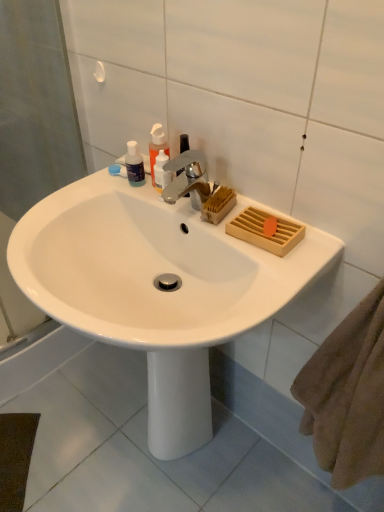
Question: Is translucent plastic soap dispenser at upper center surrounded by white glossy sink at center?

Choices:
 (A) yes
 (B) no

Answer: (B)

Question: From the image's perspective, is white glossy sink at center under translucent plastic soap dispenser at upper center?

Choices:
 (A) no
 (B) yes

Answer: (B)

Question: Does white glossy sink at center have a greater width compared to translucent plastic soap dispenser at upper center?

Choices:
 (A) no
 (B) yes

Answer: (B)

Question: Is the surface of white glossy sink at center in direct contact with translucent plastic soap dispenser at upper center?

Choices:
 (A) no
 (B) yes

Answer: (A)

Question: Can you confirm if white glossy sink at center is smaller than translucent plastic soap dispenser at upper center?

Choices:
 (A) no
 (B) yes

Answer: (A)

Question: Would you say white glossy sink at center is outside translucent plastic soap dispenser at upper center?

Choices:
 (A) no
 (B) yes

Answer: (B)

Question: Can you confirm if translucent plastic bottles at upper left, which ranks as the second toiletry in left-to-right order, is smaller than translucent plastic soap dispenser at upper center?

Choices:
 (A) no
 (B) yes

Answer: (B)

Question: From the image's perspective, is translucent plastic bottles at upper left, which ranks as the second toiletry in left-to-right order, below translucent plastic soap dispenser at upper center?

Choices:
 (A) no
 (B) yes

Answer: (B)

Question: Is translucent plastic bottles at upper left, which ranks as the second toiletry in left-to-right order, not inside translucent plastic soap dispenser at upper center?

Choices:
 (A) no
 (B) yes

Answer: (B)

Question: Considering the relative positions of translucent plastic bottles at upper left, which ranks as the second toiletry in left-to-right order, and translucent plastic soap dispenser at upper center in the image provided, is translucent plastic bottles at upper left, which ranks as the second toiletry in left-to-right order, to the left of translucent plastic soap dispenser at upper center from the viewer's perspective?

Choices:
 (A) yes
 (B) no

Answer: (B)

Question: Is translucent plastic bottles at upper left, which ranks as the second toiletry in left-to-right order, with translucent plastic soap dispenser at upper center?

Choices:
 (A) no
 (B) yes

Answer: (B)

Question: From a real-world perspective, does translucent plastic bottles at upper left, which ranks as the second toiletry in left-to-right order, stand above translucent plastic soap dispenser at upper center?

Choices:
 (A) no
 (B) yes

Answer: (A)

Question: From the image's perspective, is white glossy sink at center above translucent plastic bottle at upper left, the 1th toiletry viewed from the left?

Choices:
 (A) yes
 (B) no

Answer: (B)